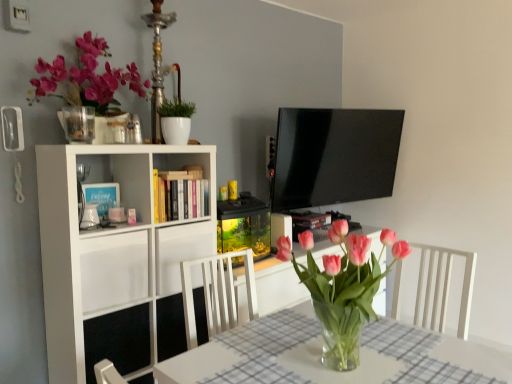
The height and width of the screenshot is (384, 512). I want to click on free space above clear glass vase at center (from a real-world perspective), so click(334, 364).